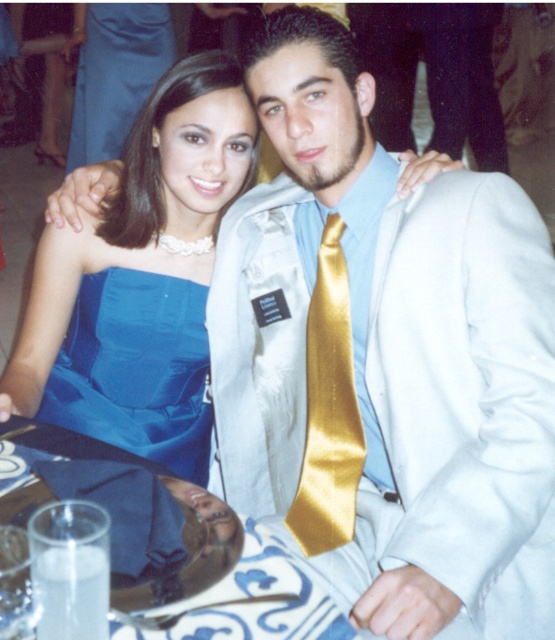
You are a photographer setting up for a formal event. You need to place a small prop exactly at the center of the image. The coordinates given are point (388, 355). According to the scene description, what object is located at this point?

The point (388, 355) corresponds to the satin white suit at center.